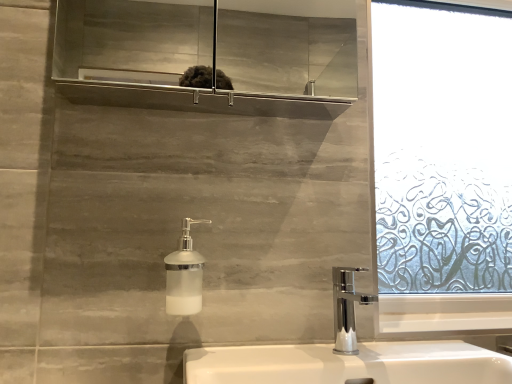
Question: Is white ceramic sink at lower center outside white frosted glass soap dispenser at center?

Choices:
 (A) yes
 (B) no

Answer: (A)

Question: From the image's perspective, is white ceramic sink at lower center located above white frosted glass soap dispenser at center?

Choices:
 (A) no
 (B) yes

Answer: (A)

Question: Is white ceramic sink at lower center in contact with white frosted glass soap dispenser at center?

Choices:
 (A) yes
 (B) no

Answer: (B)

Question: Could you tell me if white ceramic sink at lower center is facing white frosted glass soap dispenser at center?

Choices:
 (A) no
 (B) yes

Answer: (A)

Question: Considering the relative sizes of white ceramic sink at lower center and white frosted glass soap dispenser at center in the image provided, is white ceramic sink at lower center thinner than white frosted glass soap dispenser at center?

Choices:
 (A) no
 (B) yes

Answer: (A)

Question: From the image's perspective, is white ceramic sink at lower center located beneath white frosted glass soap dispenser at center?

Choices:
 (A) yes
 (B) no

Answer: (A)

Question: Does white frosted glass soap dispenser at center turn towards white ceramic sink at lower center?

Choices:
 (A) yes
 (B) no

Answer: (B)

Question: From the image's perspective, is white frosted glass soap dispenser at center over white ceramic sink at lower center?

Choices:
 (A) no
 (B) yes

Answer: (B)

Question: Are white frosted glass soap dispenser at center and white ceramic sink at lower center beside each other?

Choices:
 (A) yes
 (B) no

Answer: (B)

Question: Does white frosted glass soap dispenser at center have a smaller size compared to white ceramic sink at lower center?

Choices:
 (A) no
 (B) yes

Answer: (B)

Question: Considering the relative sizes of white frosted glass soap dispenser at center and white ceramic sink at lower center in the image provided, is white frosted glass soap dispenser at center shorter than white ceramic sink at lower center?

Choices:
 (A) yes
 (B) no

Answer: (A)

Question: Is white frosted glass soap dispenser at center far away from white ceramic sink at lower center?

Choices:
 (A) no
 (B) yes

Answer: (A)

Question: Considering the positions of white frosted glass soap dispenser at center and white ceramic sink at lower center in the image, is white frosted glass soap dispenser at center taller or shorter than white ceramic sink at lower center?

Choices:
 (A) tall
 (B) short

Answer: (B)